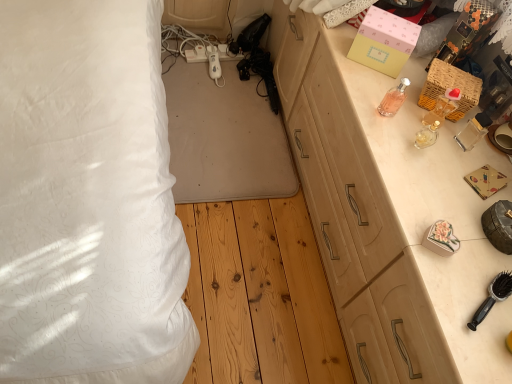
Identify the location of vacant area on the back side of translucent glass perfume at right, the 2th perfume viewed from the right. The width and height of the screenshot is (512, 384). (407, 106).